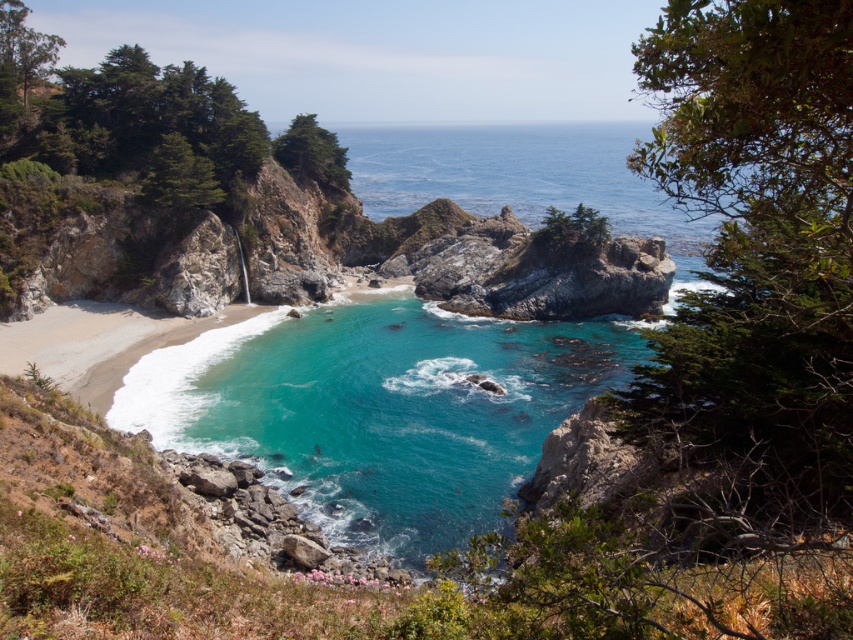
Who is higher up, turquoise glossy water at center or clear blue water at center?

clear blue water at center

Looking at this image, does turquoise glossy water at center have a greater width compared to clear blue water at center?

Incorrect, turquoise glossy water at center's width does not surpass clear blue water at center's.

Locate an element on the screen. turquoise glossy water at center is located at coordinates (381, 410).

The height and width of the screenshot is (640, 853). Identify the location of turquoise glossy water at center. (381, 410).